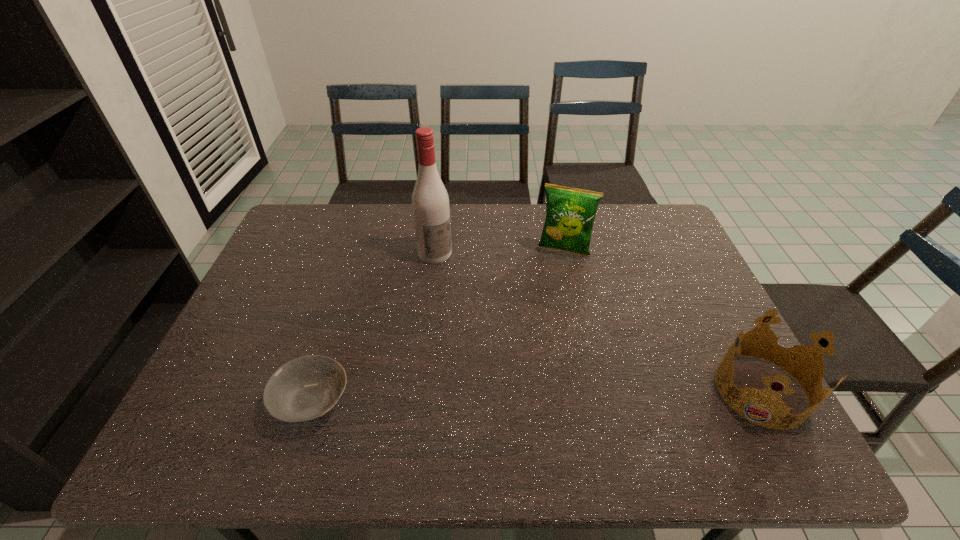
At what (x,y) coordinates should I click in order to perform the action: click on free space on the desktop that is between the shortest object and the crown and is positioned on the front-facing side of the third shortest object. Please return your answer as a coordinate pair (x, y). This screenshot has width=960, height=540. Looking at the image, I should click on (521, 396).

This screenshot has height=540, width=960. Find the location of `free spot on the desktop that is between the shortest object and the crown and is positioned on the label of the alcohol`. free spot on the desktop that is between the shortest object and the crown and is positioned on the label of the alcohol is located at coordinates (540, 396).